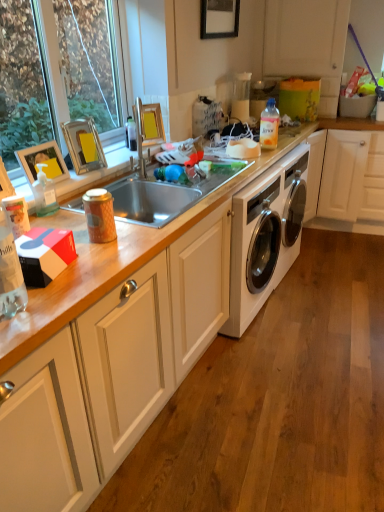
Question: In terms of height, does white matte cabinet at upper right, positioned as the first cabinetry in top-to-bottom order, look taller or shorter compared to metallic silver picture frame at upper left, marked as the first picture frame in a front-to-back arrangement?

Choices:
 (A) tall
 (B) short

Answer: (A)

Question: Does point (271, 32) appear closer or farther from the camera than point (54, 153)?

Choices:
 (A) farther
 (B) closer

Answer: (A)

Question: Considering the real-world distances, which object is farthest from the white matte cabinet at lower left, the 2th cabinetry viewed from the top?

Choices:
 (A) black matte picture frame at upper center, acting as the first picture frame starting from the top
 (B) translucent plastic bottle at upper right, which is counted as the second bottle, starting from the front
 (C) clear glass window at upper left
 (D) metallic silver picture frame at upper left, marked as the first picture frame in a front-to-back arrangement
 (E) yellow cardboard picture frame at upper center, which is counted as the 2th picture frame, starting from the right

Answer: (A)

Question: Based on their relative distances, which object is nearer to the translucent plastic bottle at left, which is the first bottle in front-to-back order?

Choices:
 (A) white glossy washing machine at center
 (B) metallic silver picture frame at upper left, marked as the first picture frame in a bottom-to-top arrangement
 (C) translucent plastic bottle at upper right, which appears as the 1th bottle when viewed from the top
 (D) silver metallic picture frame at upper left, the 3th picture frame from the top
 (E) white matte cabinet at lower left, acting as the 1th cabinetry starting from the bottom

Answer: (B)